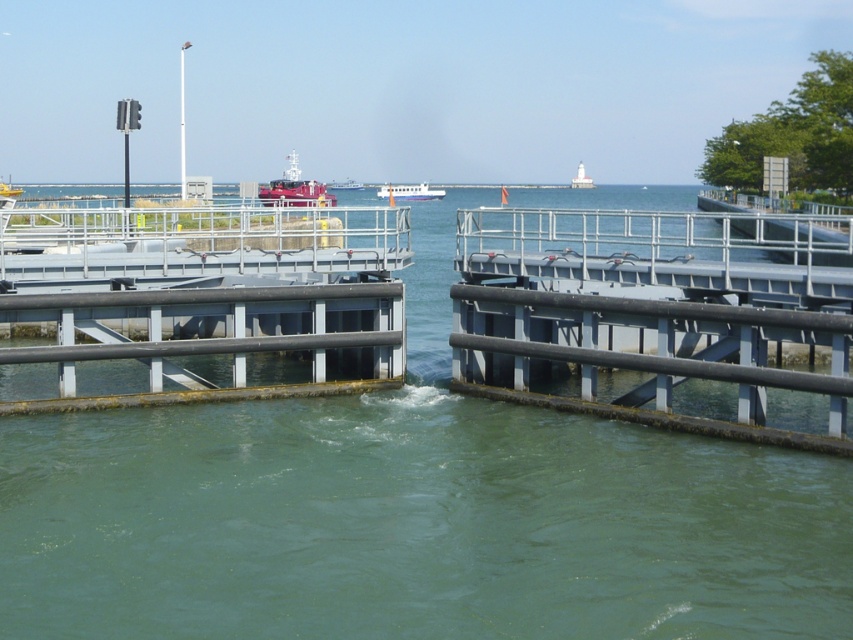
Does clear water at center appear on the right side of metallic gray rail at center?

Incorrect, clear water at center is not on the right side of metallic gray rail at center.

Find the location of a particular element. The image size is (853, 640). clear water at center is located at coordinates (412, 515).

Image resolution: width=853 pixels, height=640 pixels. What do you see at coordinates (412, 515) in the screenshot?
I see `clear water at center` at bounding box center [412, 515].

From the picture: Is clear water at center closer to camera compared to white glossy boat at center?

Yes, it is in front of white glossy boat at center.

Identify the location of clear water at center. This screenshot has height=640, width=853. (412, 515).

I want to click on clear water at center, so click(412, 515).

Does clear water at center have a lesser height compared to white matte lighthouse at upper center?

Incorrect, clear water at center's height does not fall short of white matte lighthouse at upper center's.

Is point (300, 470) positioned behind point (582, 177)?

No.

Between point (10, 630) and point (572, 188), which one is positioned behind?

The point (572, 188) is more distant.

Where is `clear water at center`? clear water at center is located at coordinates (412, 515).